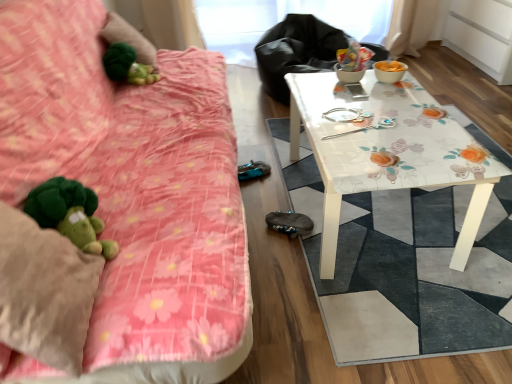
Find the location of a particular element. The height and width of the screenshot is (384, 512). vacant area on the back side of metallic silver spoon at center is located at coordinates (352, 106).